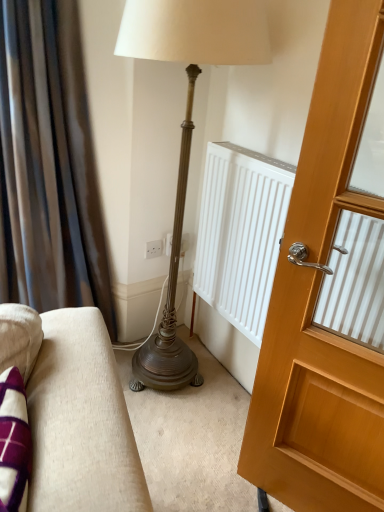
This screenshot has width=384, height=512. I want to click on brown velvet curtain at left, so click(x=48, y=165).

What do you see at coordinates (48, 165) in the screenshot?
I see `brown velvet curtain at left` at bounding box center [48, 165].

This screenshot has height=512, width=384. Find the location of `wooden door at right`. wooden door at right is located at coordinates (315, 303).

Image resolution: width=384 pixels, height=512 pixels. What do you see at coordinates (315, 303) in the screenshot? I see `wooden door at right` at bounding box center [315, 303].

Locate an element on the screen. brown velvet curtain at left is located at coordinates (48, 165).

Is wooden door at right at the left side of brown velvet curtain at left?

In fact, wooden door at right is to the right of brown velvet curtain at left.

Is wooden door at right behind brown velvet curtain at left?

No, wooden door at right is in front of brown velvet curtain at left.

Does point (362, 462) come in front of point (99, 246)?

Yes, point (362, 462) is closer to viewer.

From the image's perspective, is wooden door at right above or below brown velvet curtain at left?

wooden door at right is below brown velvet curtain at left.

From a real-world perspective, is wooden door at right physically located above or below brown velvet curtain at left?

Clearly, from a real-world perspective, wooden door at right is below brown velvet curtain at left.

Considering the sizes of objects wooden door at right and brown velvet curtain at left in the image provided, who is wider, wooden door at right or brown velvet curtain at left?

brown velvet curtain at left is wider.

Can you confirm if wooden door at right is taller than brown velvet curtain at left?

No.

Is wooden door at right bigger or smaller than brown velvet curtain at left?

In the image, wooden door at right appears to be smaller than brown velvet curtain at left.

Would you say brown velvet curtain at left is part of wooden door at right's contents?

No, brown velvet curtain at left is located outside of wooden door at right.

Are wooden door at right and brown velvet curtain at left located far from each other?

wooden door at right is positioned a significant distance from brown velvet curtain at left.

Is wooden door at right positioned with its back to brown velvet curtain at left?

wooden door at right does not have its back to brown velvet curtain at left.

Can you tell me how much wooden door at right and brown velvet curtain at left differ in facing direction?

They differ by 11.4 degrees in their facing directions.

How much distance is there between wooden door at right and brown velvet curtain at left?

3.48 feet.

Identify the location of curtain above the wooden door at right (from the image's perspective). (48, 165).

Does brown velvet curtain at left appear on the right side of wooden door at right?

Incorrect, brown velvet curtain at left is not on the right side of wooden door at right.

Which object is closer to the camera, brown velvet curtain at left or wooden door at right?

wooden door at right is more forward.

Is point (31, 9) less distant than point (320, 218)?

No, (31, 9) is further to viewer.

From the image's perspective, is brown velvet curtain at left located beneath wooden door at right?

No, from the image's perspective, brown velvet curtain at left is not below wooden door at right.

From a real-world perspective, which object rests below the other?

wooden door at right, from a real-world perspective.

In terms of width, does brown velvet curtain at left look wider or thinner when compared to wooden door at right?

Clearly, brown velvet curtain at left has more width compared to wooden door at right.

Does brown velvet curtain at left have a lesser height compared to wooden door at right?

Incorrect, the height of brown velvet curtain at left does not fall short of that of wooden door at right.

Consider the image. Between brown velvet curtain at left and wooden door at right, which one has larger size?

brown velvet curtain at left is bigger.

Is wooden door at right inside brown velvet curtain at left?

Actually, wooden door at right is outside brown velvet curtain at left.

Is brown velvet curtain at left placed right next to wooden door at right?

No, brown velvet curtain at left is not touching wooden door at right.

Is brown velvet curtain at left oriented away from wooden door at right?

That's not correct — brown velvet curtain at left is not looking away from wooden door at right.

What's the angular difference between brown velvet curtain at left and wooden door at right's facing directions?

They differ by 11.4 degrees in their facing directions.

At what (x,y) coordinates should I click in order to perform the action: click on door in front of the brown velvet curtain at left. Please return your answer as a coordinate pair (x, y). The height and width of the screenshot is (512, 384). Looking at the image, I should click on (315, 303).

Where is `door below the brown velvet curtain at left (from the image's perspective)`? The width and height of the screenshot is (384, 512). door below the brown velvet curtain at left (from the image's perspective) is located at coordinates (315, 303).

The image size is (384, 512). I want to click on curtain above the wooden door at right (from the image's perspective), so click(48, 165).